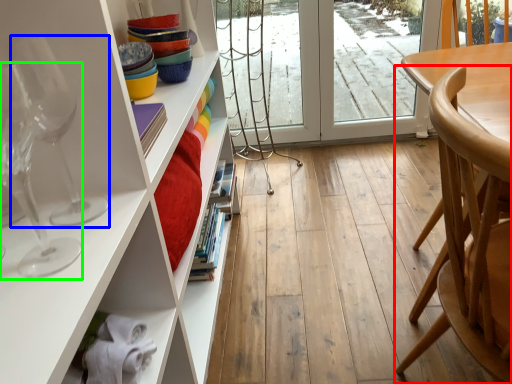
Question: Which is nearer to the chair (highlighted by a red box)? wine glass (highlighted by a blue box) or wine glass (highlighted by a green box).

Choices:
 (A) wine glass
 (B) wine glass

Answer: (A)